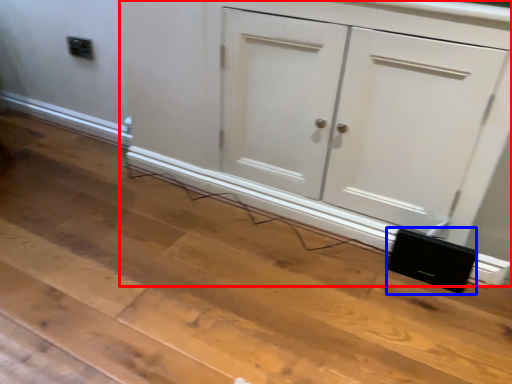
Question: Which object appears closest to the camera in this image, cupboard (highlighted by a red box) or speaker (highlighted by a blue box)?

Choices:
 (A) cupboard
 (B) speaker

Answer: (A)